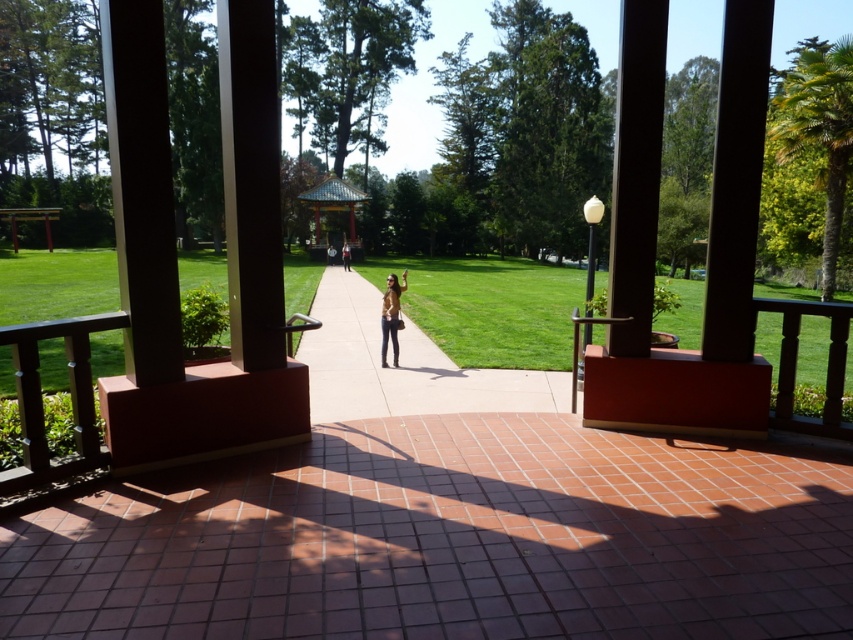
Can you confirm if smooth concrete sidewalk at center is positioned to the left of multicolored tiled gazebo at center?

In fact, smooth concrete sidewalk at center is to the right of multicolored tiled gazebo at center.

Find the location of a particular element. smooth concrete sidewalk at center is located at coordinates (403, 364).

Who is more forward, (x=312, y=211) or (x=343, y=250)?

Point (x=343, y=250) is in front.

Which is behind, point (316, 193) or point (343, 252)?

The point (316, 193) is behind.

Locate an element on the screen. multicolored tiled gazebo at center is located at coordinates (334, 209).

Is multicolored tiled gazebo at center to the left of leather jacket at center from the viewer's perspective?

Yes, multicolored tiled gazebo at center is to the left of leather jacket at center.

Does point (355, 193) come closer to viewer compared to point (396, 339)?

That is False.

Locate an element on the screen. Image resolution: width=853 pixels, height=640 pixels. multicolored tiled gazebo at center is located at coordinates (334, 209).